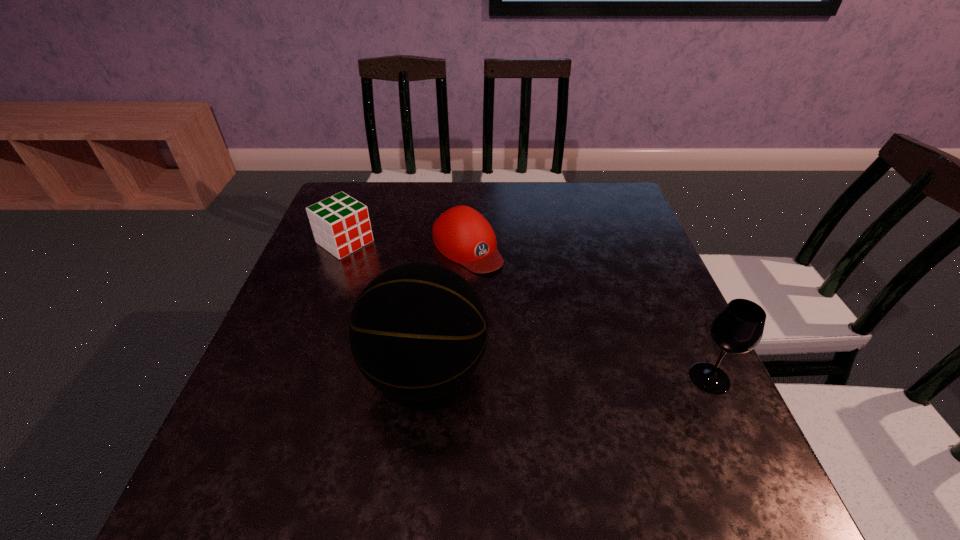
At what (x,y) coordinates should I click in order to perform the action: click on vacant area located on the front-facing side of the baseball cap. Please return your answer as a coordinate pair (x, y). Image resolution: width=960 pixels, height=540 pixels. Looking at the image, I should click on (513, 296).

Where is `vacant region located 0.080m on the front-facing side of the baseball cap`? Image resolution: width=960 pixels, height=540 pixels. vacant region located 0.080m on the front-facing side of the baseball cap is located at coordinates (505, 289).

Identify the location of vacant space situated on the front-facing side of the baseball cap. The image size is (960, 540). (537, 321).

Image resolution: width=960 pixels, height=540 pixels. I want to click on cube present at the far edge, so click(340, 224).

At what (x,y) coordinates should I click in order to perform the action: click on baseball cap present at the far edge. Please return your answer as a coordinate pair (x, y). The height and width of the screenshot is (540, 960). Looking at the image, I should click on (461, 234).

The image size is (960, 540). I want to click on object that is at the near edge, so click(x=417, y=332).

At what (x,y) coordinates should I click in order to perform the action: click on object present at the left edge. Please return your answer as a coordinate pair (x, y). Looking at the image, I should click on (340, 224).

I want to click on object located in the right edge section of the desktop, so click(x=738, y=328).

This screenshot has width=960, height=540. In order to click on object situated at the far left corner in this screenshot , I will do `click(340, 224)`.

Image resolution: width=960 pixels, height=540 pixels. In the image, there is a desktop. In order to click on free space at the far edge in this screenshot , I will do click(x=452, y=193).